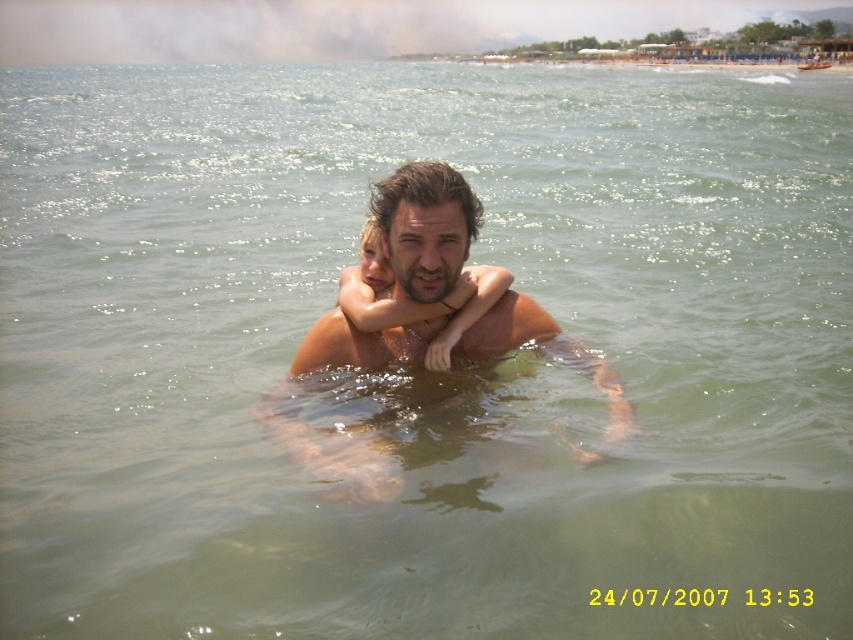
Does point (306, 442) come in front of point (460, 298)?

Yes, point (306, 442) is in front of point (460, 298).

Locate an element on the screen. smooth skin man at center is located at coordinates (422, 230).

Who is more forward, (x=415, y=352) or (x=431, y=344)?

Positioned in front is point (x=431, y=344).

This screenshot has height=640, width=853. I want to click on smooth skin man at center, so click(x=422, y=230).